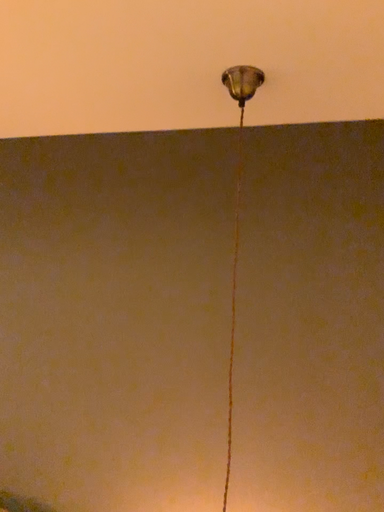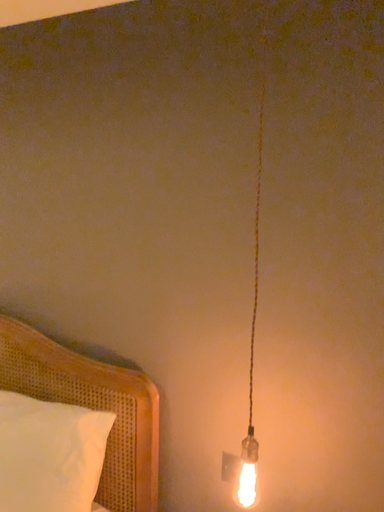
Question: How did the camera likely rotate when shooting the video?

Choices:
 (A) rotated right
 (B) rotated left

Answer: (B)